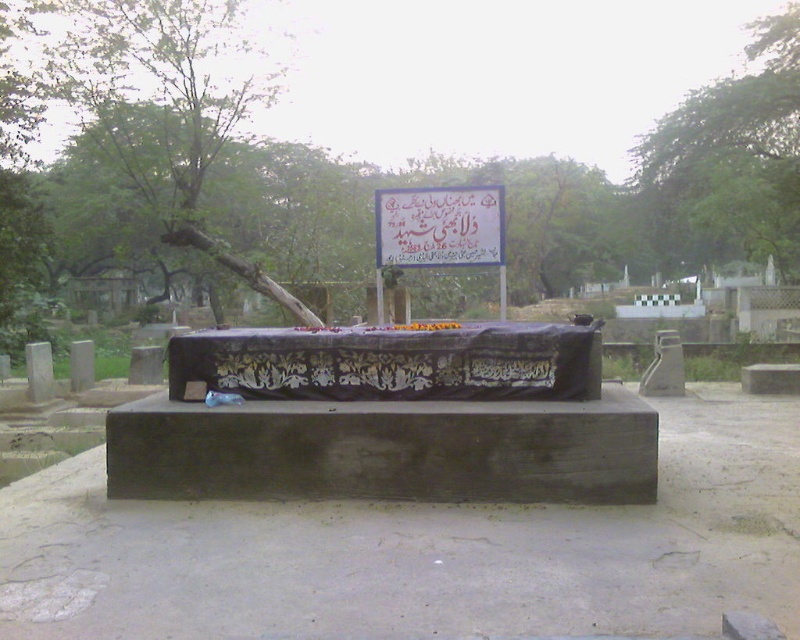
Question: Which object is positioned closest to the green leafy tree at upper right?

Choices:
 (A) green leafy tree at left
 (B) green leafy tree at center

Answer: (B)

Question: Is the position of green leafy tree at left more distant than that of white paper sign at center?

Choices:
 (A) yes
 (B) no

Answer: (A)

Question: Does green leafy tree at center have a larger size compared to green leafy tree at upper right?

Choices:
 (A) no
 (B) yes

Answer: (B)

Question: Which point is closer to the camera?

Choices:
 (A) green leafy tree at upper right
 (B) white paper sign at center

Answer: (B)

Question: Is green leafy tree at upper right to the right of white paper sign at center from the viewer's perspective?

Choices:
 (A) no
 (B) yes

Answer: (B)

Question: Which object is closer to the camera taking this photo?

Choices:
 (A) green leafy tree at center
 (B) green leafy tree at upper right
 (C) green leafy tree at left

Answer: (C)